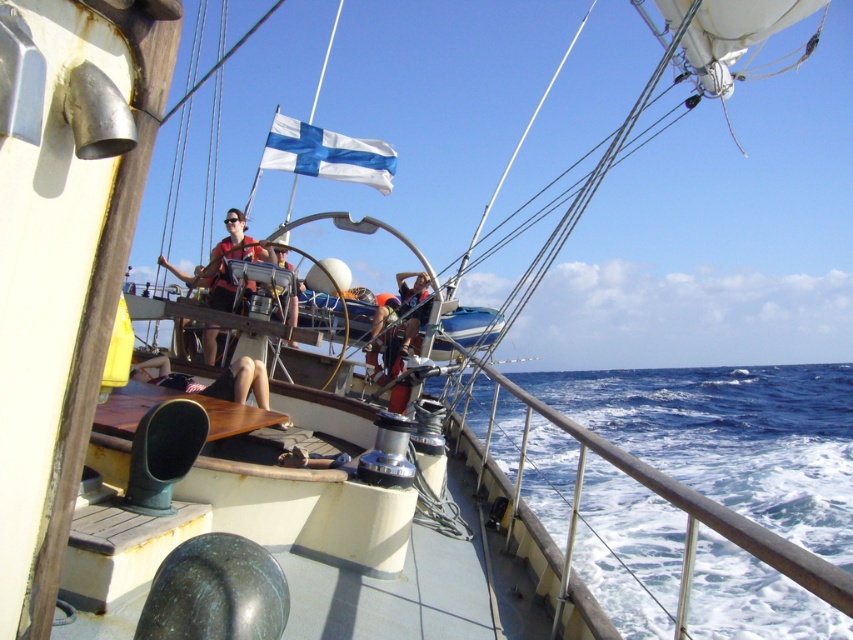
You are standing on the deck of the sailing vessel and want to reach the point marked at coordinates point [805,534]. If your walking speed is 1.2 meters per second, how many seconds will it take you to reach that point?

The point [805,534] is 9.74 meters away from the camera. At a walking speed of 1.2 meters per second, it would take approximately 8.12 seconds to reach the point.

You are standing on the deck of the boat and want to reach a point that is 20 feet away from you. Is the point at coordinate point (164, 355) within your reach?

The point at coordinate point (164, 355) is 18.43 feet away from you, so yes, it is within your reach since it is closer than 20 feet.

Looking at this image, you are a safety inspector on the deck of the ship and need to ensure that the matte black helmet at center is placed in a secure location away from the blue water at lower right. Based on their sizes, can you determine if the helmet will fit on a shelf that is the same width as the water?

The blue water at lower right is wider than the matte black helmet at center. Since the shelf is the same width as the water, the matte black helmet at center will fit on the shelf because it is narrower than the shelf.